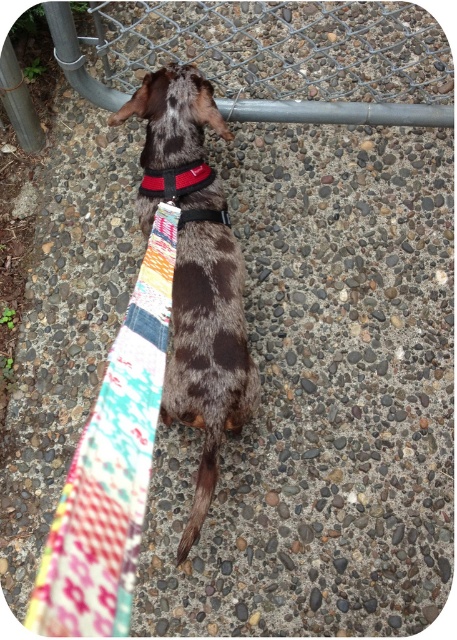
Based on the photo, can you confirm if spotted fur dog at center is taller than black fabric strap at center?

Indeed, spotted fur dog at center has a greater height compared to black fabric strap at center.

Is spotted fur dog at center wider than black fabric strap at center?

Yes, spotted fur dog at center is wider than black fabric strap at center.

Which is behind, point (159, 115) or point (212, 211)?

The point (212, 211) is behind.

Locate an element on the screen. spotted fur dog at center is located at coordinates (207, 353).

At what (x,y) coordinates should I click in order to perform the action: click on brushed metal pole at upper left. Please return your answer as a coordinate pair (x, y). This screenshot has height=640, width=457. Looking at the image, I should click on (19, 100).

Between point (21, 81) and point (191, 188), which one is positioned in front?

Point (191, 188) is in front.

Describe the element at coordinates (19, 100) in the screenshot. The image size is (457, 640). I see `brushed metal pole at upper left` at that location.

I want to click on brushed metal pole at upper left, so click(19, 100).

Who is more forward, (100,529) or (159,177)?

Point (100,529) is in front.

Between patchwork fabric tie at lower left and red fabric neckband at center, which one is positioned lower?

Positioned lower is patchwork fabric tie at lower left.

Is point (127, 582) behind point (153, 173)?

That is False.

You are a GUI agent. You are given a task and a screenshot of the screen. Output one action in this format:
    pyautogui.click(x=<x>, y=<y>)
    Task: Click on the patchwork fabric tie at lower left
    This screenshot has width=457, height=640.
    Given the screenshot: What is the action you would take?
    pyautogui.click(x=111, y=467)